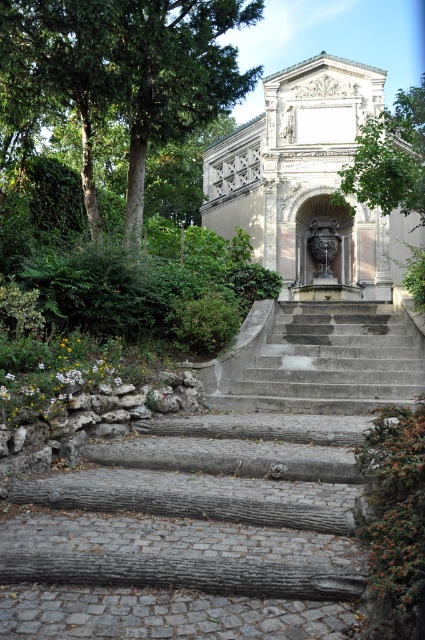
You are a gardener who needs to water the green leafy tree at center using a hose that can reach up to 30 feet. The stone fountain at center is in the way. Can you reach the tree without moving the fountain?

The distance between the stone fountain at center and green leafy tree at center is 29.36 feet. Since the hose can reach up to 30 feet, you can water the green leafy tree at center without moving the fountain as the distance is within the hose reach.

You are standing in front of the classical structure and want to take a photo of the green leafy tree at upper left. If your camera can focus on objects up to 25 meters away, will you be able to capture a clear image of the tree?

The green leafy tree at upper left is 25.99 meters from viewer. Since the camera can focus up to 25 meters, the tree is slightly beyond the camera range, so it wonot be in focus. Move closer or use a different camera.